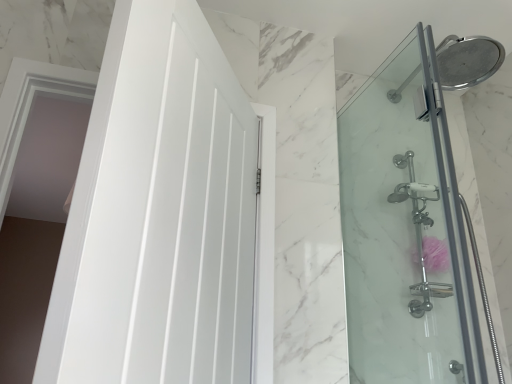
Locate an element on the screen. This screenshot has width=512, height=384. white glossy door at left is located at coordinates (166, 216).

What do you see at coordinates (166, 216) in the screenshot?
I see `white glossy door at left` at bounding box center [166, 216].

The image size is (512, 384). What are the coordinates of `clear glass shower door at right` in the screenshot? It's located at (405, 229).

Image resolution: width=512 pixels, height=384 pixels. What do you see at coordinates (405, 229) in the screenshot?
I see `clear glass shower door at right` at bounding box center [405, 229].

Where is `white glossy door at left`? white glossy door at left is located at coordinates (166, 216).

Visually, is white glossy door at left positioned to the left or to the right of clear glass shower door at right?

white glossy door at left is to the left of clear glass shower door at right.

Is white glossy door at left positioned in front of clear glass shower door at right?

Yes.

Which is further, (112, 255) or (358, 163)?

The point (358, 163) is farther from the camera.

From the image's perspective, is white glossy door at left above or below clear glass shower door at right?

white glossy door at left is above clear glass shower door at right.

From a real-world perspective, which object rests below the other?

white glossy door at left, from a real-world perspective.

Which of these two, white glossy door at left or clear glass shower door at right, is wider?

With larger width is white glossy door at left.

Based on the photo, in terms of height, does white glossy door at left look taller or shorter compared to clear glass shower door at right?

Clearly, white glossy door at left is shorter compared to clear glass shower door at right.

In the scene shown: Is white glossy door at left bigger than clear glass shower door at right?

Yes, white glossy door at left is bigger than clear glass shower door at right.

Choose the correct answer: Is white glossy door at left inside clear glass shower door at right or outside it?

white glossy door at left cannot be found inside clear glass shower door at right.

Is the surface of white glossy door at left in direct contact with clear glass shower door at right?

No, white glossy door at left is not next to clear glass shower door at right.

Is white glossy door at left facing away from clear glass shower door at right?

Absolutely, white glossy door at left is directed away from clear glass shower door at right.

Find the location of a particular element. door located above the clear glass shower door at right (from the image's perspective) is located at coordinates (166, 216).

Between clear glass shower door at right and white glossy door at left, which one appears on the right side from the viewer's perspective?

clear glass shower door at right.

From the picture: Is clear glass shower door at right further to the viewer compared to white glossy door at left?

Yes, clear glass shower door at right is further from the viewer.

Which is closer, (423, 129) or (115, 172)?

Point (115, 172)

From the image's perspective, relative to white glossy door at left, is clear glass shower door at right above or below?

Clearly, from the image's perspective, clear glass shower door at right is below white glossy door at left.

From a real-world perspective, is clear glass shower door at right positioned under white glossy door at left based on gravity?

No, from a real-world perspective, clear glass shower door at right is not beneath white glossy door at left.

Which object is thinner, clear glass shower door at right or white glossy door at left?

clear glass shower door at right.

Who is taller, clear glass shower door at right or white glossy door at left?

clear glass shower door at right is taller.

Considering the sizes of objects clear glass shower door at right and white glossy door at left in the image provided, who is smaller, clear glass shower door at right or white glossy door at left?

clear glass shower door at right.

Can we say clear glass shower door at right lies outside white glossy door at left?

Indeed, clear glass shower door at right is completely outside white glossy door at left.

Is clear glass shower door at right far away from white glossy door at left?

clear glass shower door at right is near white glossy door at left, not far away.

Is clear glass shower door at right facing towards white glossy door at left?

A: Yes, clear glass shower door at right is oriented towards white glossy door at left.

Measure the distance between clear glass shower door at right and white glossy door at left.

The distance of clear glass shower door at right from white glossy door at left is 22.17 inches.

What are the coordinates of `screen door behind the white glossy door at left` in the screenshot? It's located at (405, 229).

The width and height of the screenshot is (512, 384). I want to click on door above the clear glass shower door at right (from the image's perspective), so click(x=166, y=216).

Identify the location of door on the left of clear glass shower door at right. (166, 216).